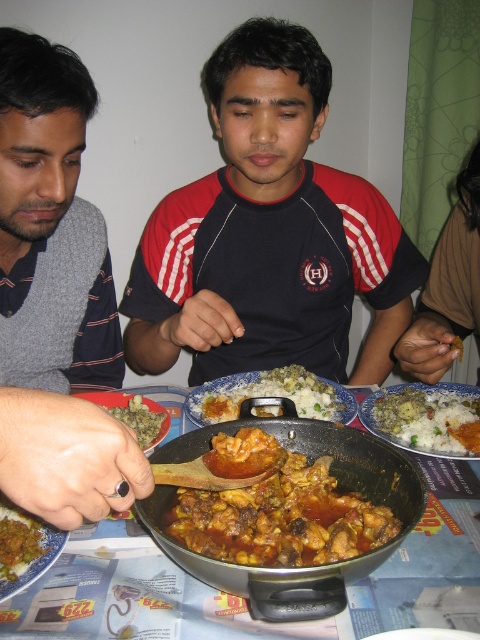
Question: Estimate the real-world distances between objects in this image. Which object is closer to the brown matte rice at lower left?

Choices:
 (A) metallic silver pan at center
 (B) green matte rice at center

Answer: (A)

Question: Is brown matte rice at center wider than green matte rice at center?

Choices:
 (A) no
 (B) yes

Answer: (B)

Question: In this image, where is brown matte chicken curry at center located relative to brown matte rice at lower left?

Choices:
 (A) below
 (B) above

Answer: (B)

Question: Among these objects, which one is farthest from the camera?

Choices:
 (A) white rice at center
 (B) metallic silver pan at center

Answer: (A)

Question: Does brown matte chicken curry at center have a smaller size compared to brown matte rice at lower left?

Choices:
 (A) yes
 (B) no

Answer: (B)

Question: Based on their relative distances, which object is nearer to the gray sweater at left?

Choices:
 (A) brown matte rice at center
 (B) metallic silver pan at center

Answer: (A)